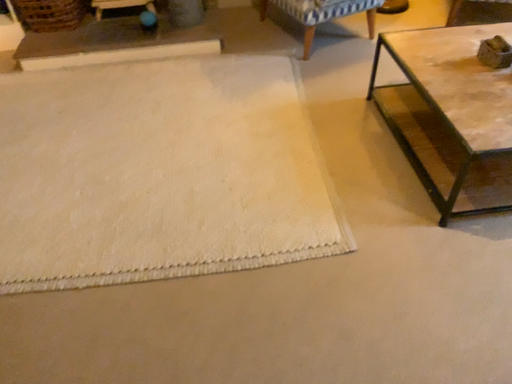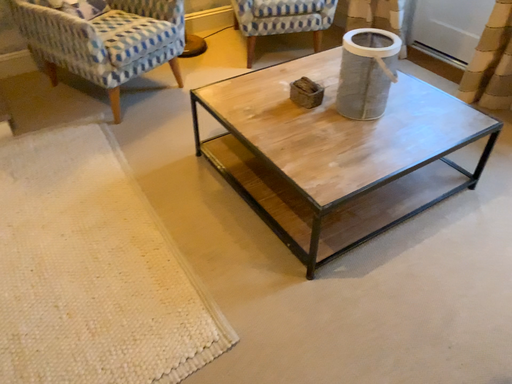
Question: How did the camera likely rotate when shooting the video?

Choices:
 (A) rotated left
 (B) rotated right

Answer: (B)